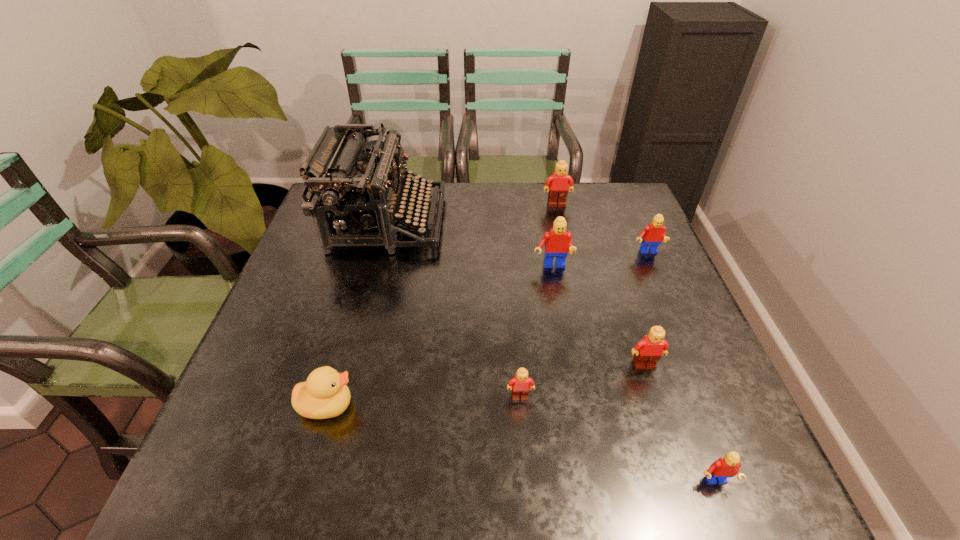
This screenshot has width=960, height=540. Identify the location of the third object from left to right. (519, 385).

You are a GUI agent. You are given a task and a screenshot of the screen. Output one action in this format:
    pyautogui.click(x=<x>, y=<y>)
    Task: Click on the smallest brown Lego
    The width and height of the screenshot is (960, 540).
    Given the screenshot: What is the action you would take?
    pyautogui.click(x=519, y=385)

Locate an element on the screen. This screenshot has height=540, width=960. the smallest red Lego is located at coordinates (725, 467).

The image size is (960, 540). I want to click on the nearest Lego, so click(x=725, y=467).

The width and height of the screenshot is (960, 540). I want to click on blank area located on the typing side of the typewriter, so click(573, 222).

Identify the location of free location located 0.370m on the face of the second brown Lego from left to right. Image resolution: width=960 pixels, height=540 pixels. (576, 292).

Locate an element on the screen. The height and width of the screenshot is (540, 960). free spot located on the front-facing side of the second farthest red Lego is located at coordinates (567, 353).

Identify the location of free space located 0.090m on the front-facing side of the second smallest red Lego. This screenshot has width=960, height=540. (659, 280).

You are a GUI agent. You are given a task and a screenshot of the screen. Output one action in this format:
    pyautogui.click(x=<x>, y=<y>)
    Task: Click on the free region located on the face of the fourth farthest Lego
    
    Given the screenshot: What is the action you would take?
    pyautogui.click(x=672, y=449)

Identify the location of free space located 0.220m on the face of the yellow duckling. (468, 405).